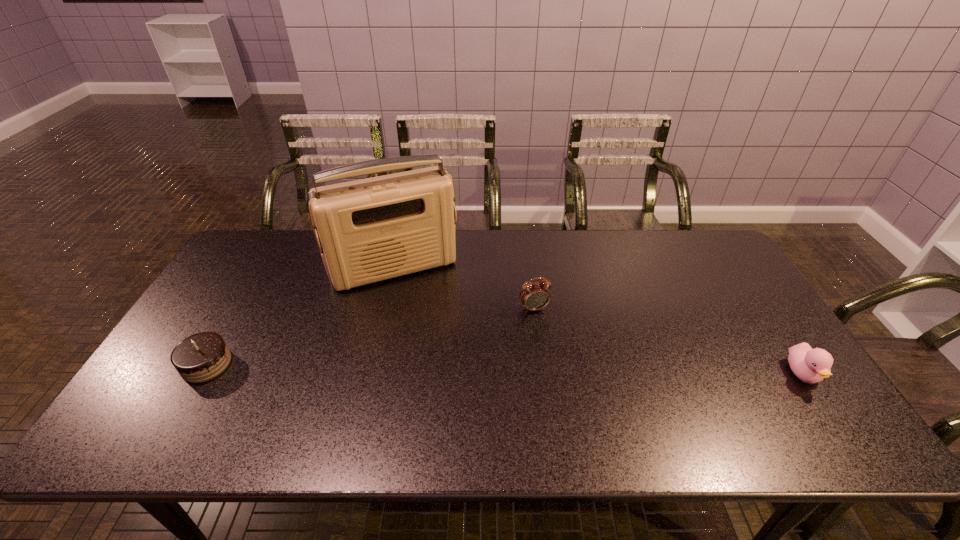
The height and width of the screenshot is (540, 960). In order to click on free spot on the desktop that is between the leftmost object and the rightmost object and is positioned on the front-facing side of the tallest object in this screenshot , I will do `click(436, 368)`.

Identify the location of free space on the desktop that is between the chocolate cake and the duckling and is positioned on the face of the third nearest object. (562, 370).